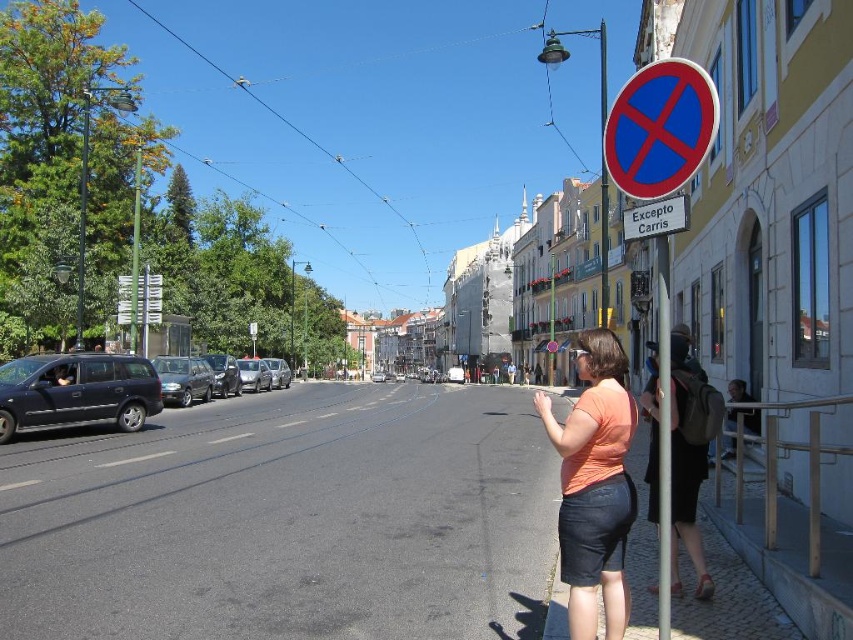
Consider the image. You are a delivery person needing to cross the street from the metallic pole at right to the metallic gray minivan at left. The road has tram tracks and parked cars. Considering the distance between them, can you walk directly from the pole to the minivan without detouring around parked cars?

The distance between the metallic pole at right and the metallic gray minivan at left is 19.06 meters. Since the road has tram tracks and parked cars, you would need to walk directly across the street. However, the parked cars on the left side might block the path. To avoid them, you could walk along the road towards the minivan while staying on the sidewalk until reaching the minivan.

You are a tourist in this European city and want to take a photo of both the blue circular sign at upper right and the blue plastic sign at upper right. However, your camera can only focus on one sign at a time. Which sign should you choose to ensure it appears larger in the photo?

The blue circular sign at upper right has a greater width than the blue plastic sign at upper right, so choosing the blue circular sign at upper right will make it appear larger in the photo.